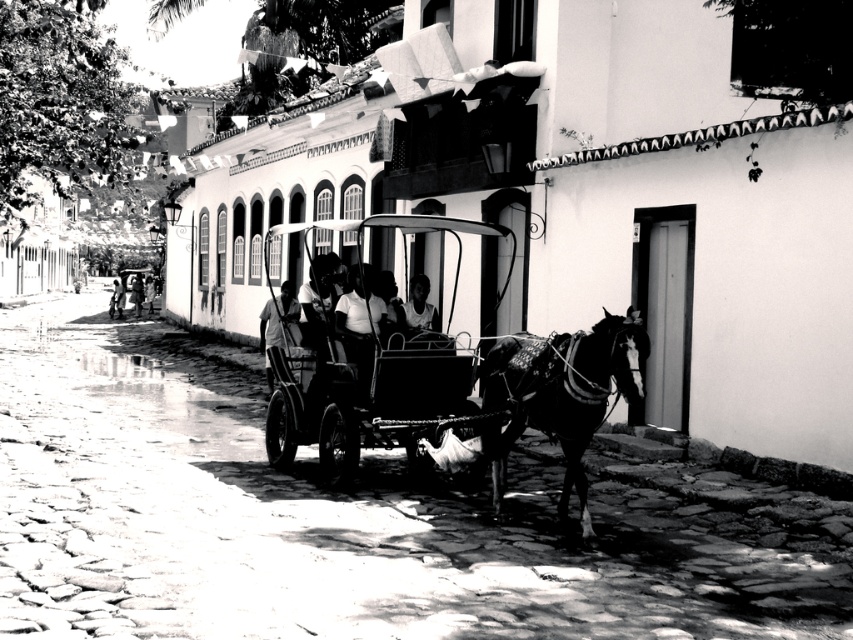
You are a photographer standing on the cobblestone street. You want to take a photo of the metallic cart at center and the shiny black horse at center. Which object should you focus on first if you want to capture both in sharp focus?

The metallic cart at center is above the shiny black horse at center, so you should focus on the shiny black horse at center first to ensure both are in sharp focus.